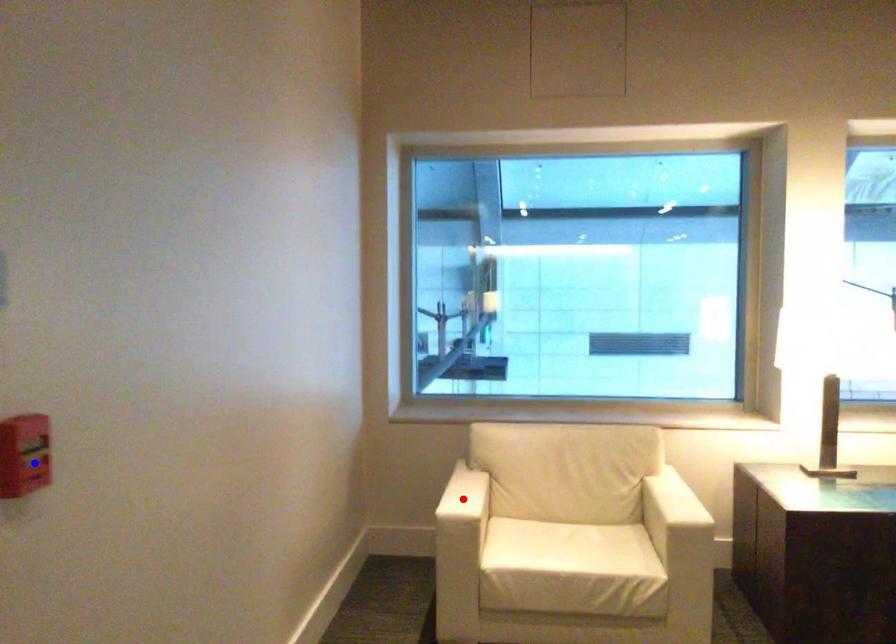
Question: Two points are marked on the image. Which point is closer to the camera?

Choices:
 (A) Blue point is closer.
 (B) Red point is closer.

Answer: (A)